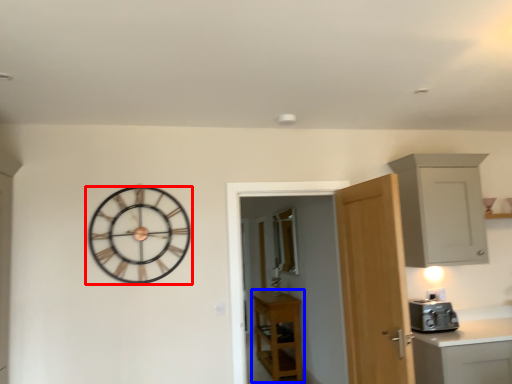
Question: Which of the following is the farthest to the observer, wall clock (highlighted by a red box) or cabinetry (highlighted by a blue box)?

Choices:
 (A) wall clock
 (B) cabinetry

Answer: (B)